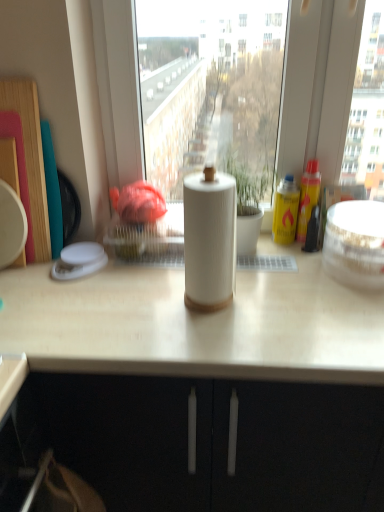
Where is `vacant space to the right of white matte paper towel at center`? vacant space to the right of white matte paper towel at center is located at coordinates (280, 308).